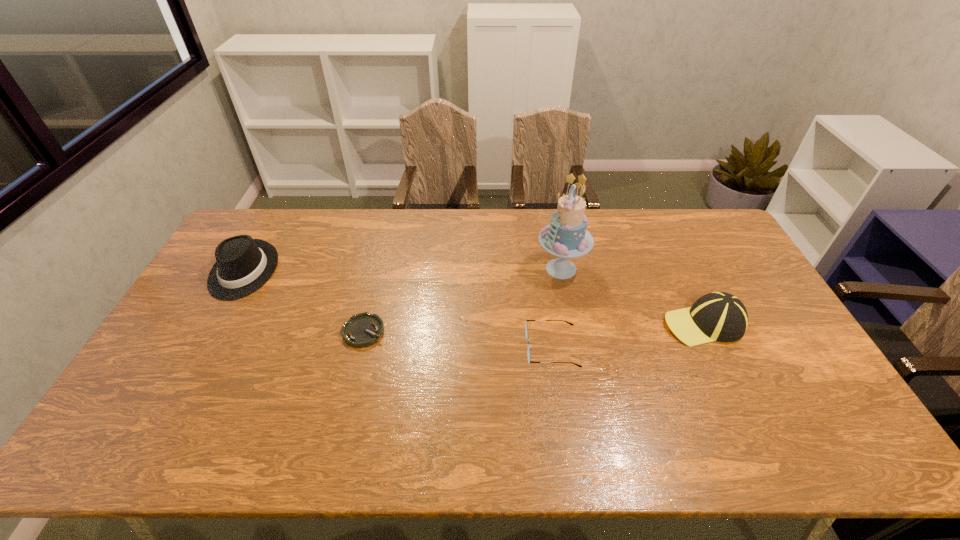
Find the location of a particular element. Image resolution: width=960 pixels, height=540 pixels. object located in the far left corner section of the desktop is located at coordinates (243, 265).

Find the location of `blank space at the far edge`. blank space at the far edge is located at coordinates (609, 210).

Where is `vacant space at the near edge of the desktop`? Image resolution: width=960 pixels, height=540 pixels. vacant space at the near edge of the desktop is located at coordinates (587, 460).

You are a GUI agent. You are given a task and a screenshot of the screen. Output one action in this format:
    pyautogui.click(x=<x>, y=<y>)
    Task: Click on the free region at the far left corner
    This screenshot has height=540, width=960.
    Given the screenshot: What is the action you would take?
    pyautogui.click(x=270, y=226)

In the image, there is a desktop. At what (x,y) coordinates should I click in order to perform the action: click on vacant space at the near right corner. Please return your answer as a coordinate pair (x, y). The height and width of the screenshot is (540, 960). Looking at the image, I should click on (831, 441).

Identify the location of vacant space in between the spectacles and the cake. (557, 308).

Where is `vacant space in between the fourth tallest object and the cake`? The image size is (960, 540). vacant space in between the fourth tallest object and the cake is located at coordinates (557, 308).

The height and width of the screenshot is (540, 960). I want to click on vacant point located between the baseball cap and the shortest object, so tap(534, 328).

This screenshot has width=960, height=540. I want to click on free space between the leftmost object and the tallest object, so click(x=402, y=269).

Find the location of a particular element. Image resolution: width=960 pixels, height=540 pixels. vacant region between the shortest object and the tallest object is located at coordinates (463, 300).